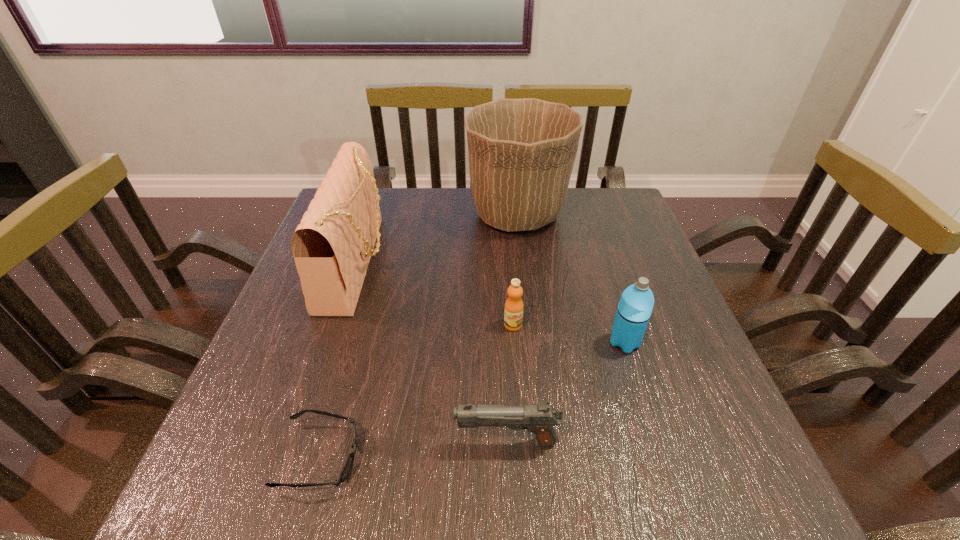
Where is `free spot located on the front label of the orange juice`? This screenshot has height=540, width=960. free spot located on the front label of the orange juice is located at coordinates (x=522, y=449).

Where is `free point located in the direction the gun is aimed`? The height and width of the screenshot is (540, 960). free point located in the direction the gun is aimed is located at coordinates (271, 442).

The height and width of the screenshot is (540, 960). In order to click on vacant space located 0.270m in the direction the gun is aimed in this screenshot , I will do `click(295, 442)`.

The image size is (960, 540). I want to click on vacant position located in the direction the gun is aimed, so click(x=283, y=442).

Identify the location of vacant space located 0.340m on the lenses of the sunglasses. (566, 457).

Identify the location of flowerpot that is at the far edge. The height and width of the screenshot is (540, 960). (521, 152).

Where is `handbag at the far edge`? The width and height of the screenshot is (960, 540). handbag at the far edge is located at coordinates (332, 246).

The image size is (960, 540). In order to click on object at the near edge in this screenshot , I will do `click(348, 465)`.

Image resolution: width=960 pixels, height=540 pixels. In order to click on handbag positioned at the left edge in this screenshot , I will do `click(332, 246)`.

This screenshot has width=960, height=540. Identify the location of sunglasses at the left edge. click(348, 465).